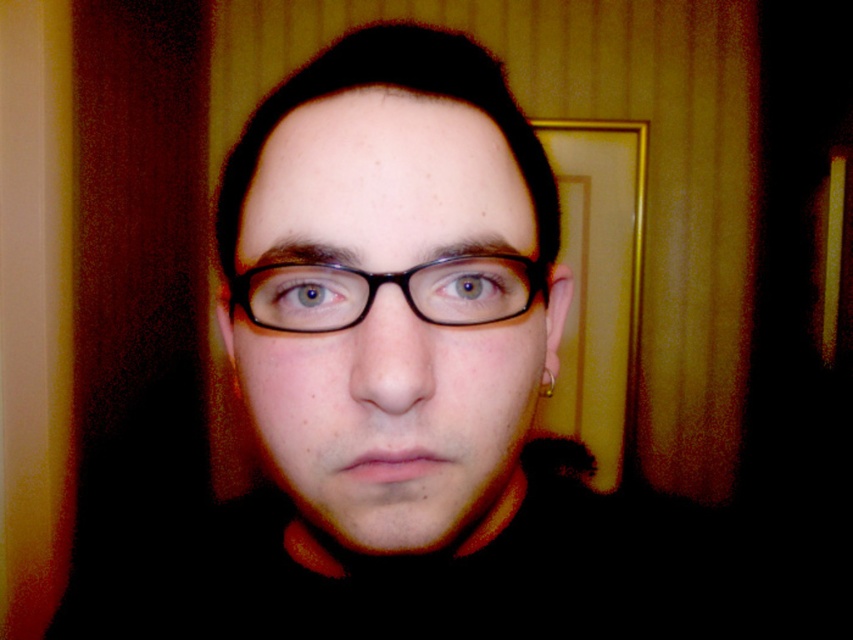
You are an optometrist examining the image of a patient. You notice the black matte glasses at center and the brown matte eye at center. Which object appears larger in the image?

The black matte glasses at center is bigger than brown matte eye at center, so the black matte glasses at center appears larger in the image.